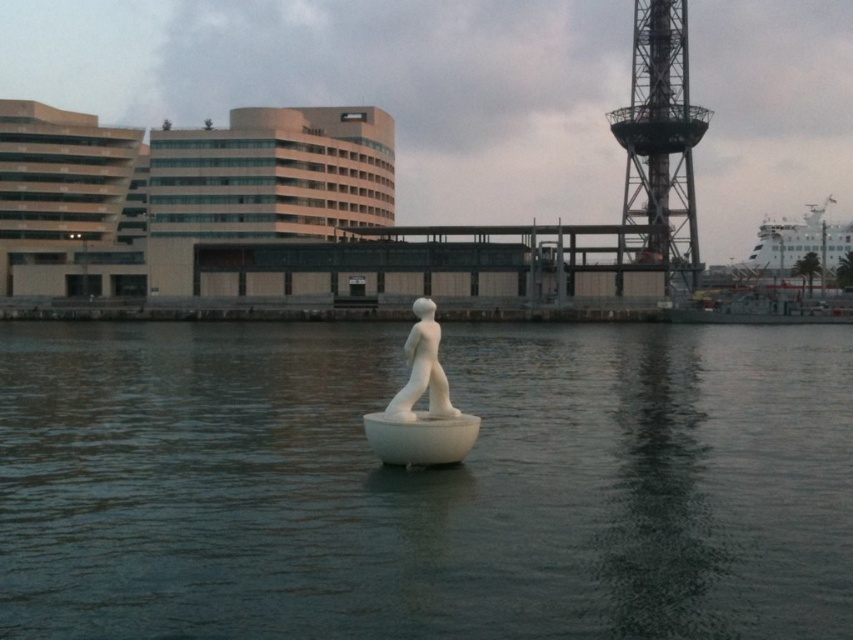
You are standing on the dock and want to take a photo of both the white matte water at center and the white glossy ship at upper right. Which object should you adjust your camera to focus on first if you want to capture both in the same frame?

Since the white matte water at center is to the left of the white glossy ship at upper right, you should focus on the white glossy ship at upper right first as it is positioned further to the right, allowing you to frame both objects by panning from left to right.

Looking at this image, you are standing at the waterfront and want to reach a specific point marked at coordinates point [722,392]. If you can walk 50 meters in 1 minute, how long will it take you to reach that point?

The distance of point [722,392] from viewer is 41.54 meters. At a walking speed of 50 meters per minute, it would take approximately 0.83 minutes, which is roughly 50 seconds, to reach the point.